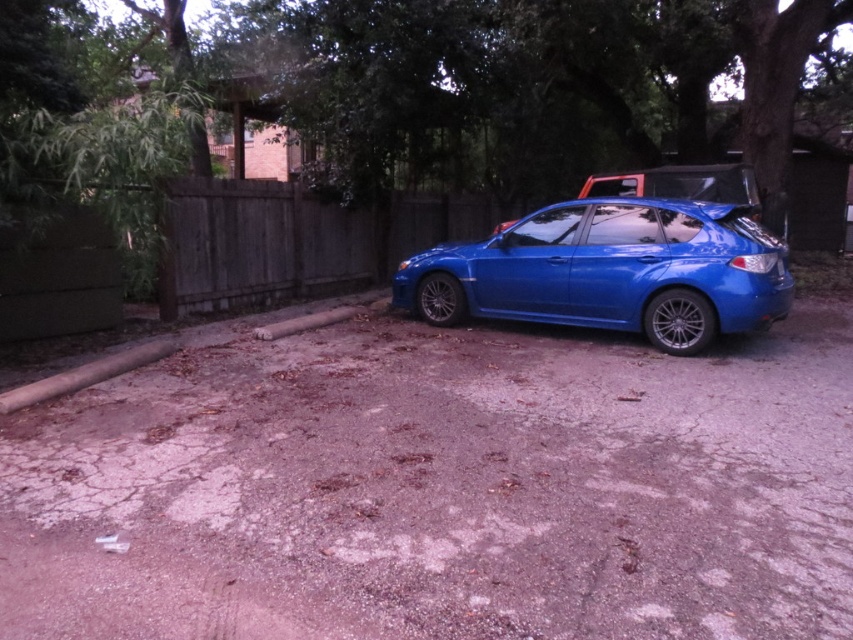
Question: Which point is farther to the camera?

Choices:
 (A) (126, 448)
 (B) (590, 259)

Answer: (B)

Question: Is glossy blue hatchback at center positioned at the back of wooden fence at center?

Choices:
 (A) yes
 (B) no

Answer: (B)

Question: Is dirt track at center to the left of wooden fence at center from the viewer's perspective?

Choices:
 (A) no
 (B) yes

Answer: (A)

Question: Which object appears closest to the camera in this image?

Choices:
 (A) dirt track at center
 (B) glossy blue hatchback at center
 (C) wooden fence at center

Answer: (A)

Question: Which object is closer to the camera taking this photo?

Choices:
 (A) glossy blue hatchback at center
 (B) dirt track at center

Answer: (B)

Question: Does dirt track at center appear under wooden fence at center?

Choices:
 (A) no
 (B) yes

Answer: (B)